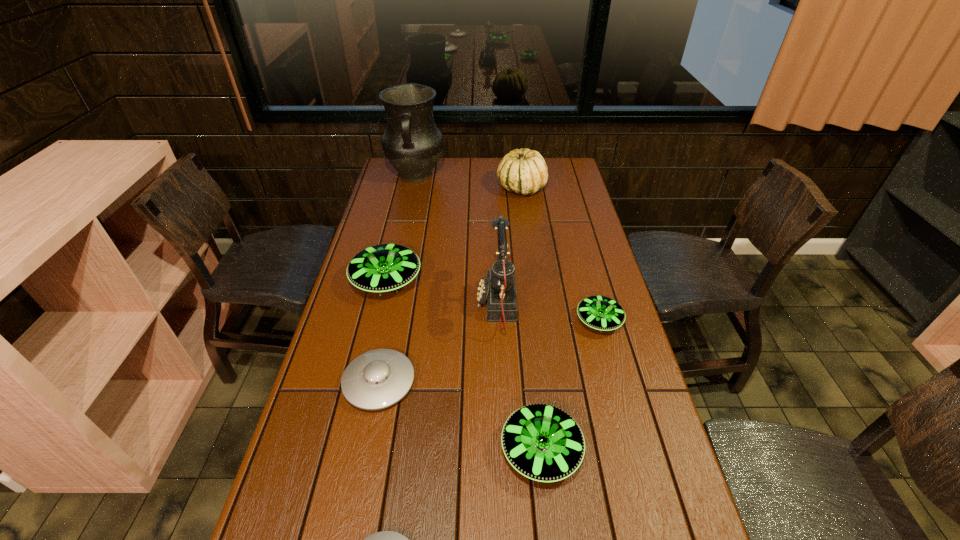
Find the location of a particular element. This screenshot has height=540, width=960. free region at the left edge of the desktop is located at coordinates (396, 233).

The height and width of the screenshot is (540, 960). I want to click on free space at the right edge of the desktop, so click(569, 193).

The image size is (960, 540). Find the location of `free spot at the far left corner of the desktop`. free spot at the far left corner of the desktop is located at coordinates (392, 172).

At what (x,y) coordinates should I click in order to perform the action: click on vacant space at the far right corner of the desktop. Please return your answer as a coordinate pair (x, y). The width and height of the screenshot is (960, 540). Looking at the image, I should click on (558, 157).

Identify the location of free point between the third tallest object and the second tallest object. (509, 246).

Where is `empty location between the pitcher and the biggest green saucer`? The image size is (960, 540). empty location between the pitcher and the biggest green saucer is located at coordinates (401, 228).

The height and width of the screenshot is (540, 960). Find the location of `empty location between the bigger gray saucer and the rightmost green saucer`. empty location between the bigger gray saucer and the rightmost green saucer is located at coordinates (489, 352).

This screenshot has height=540, width=960. What are the coordinates of `the fifth closest object to the shortest object` in the screenshot? It's located at pyautogui.click(x=602, y=313).

Identify which object is the sixth nearest to the nearer gray saucer. Please provide its 2D coordinates. Your answer should be formatted as a tuple, i.e. [(x, y)], where the tuple contains the x and y coordinates of a point satisfying the conditions above.

[(524, 171)]

This screenshot has height=540, width=960. I want to click on saucer that is the fourth closest one to the third nearest object, so click(x=602, y=313).